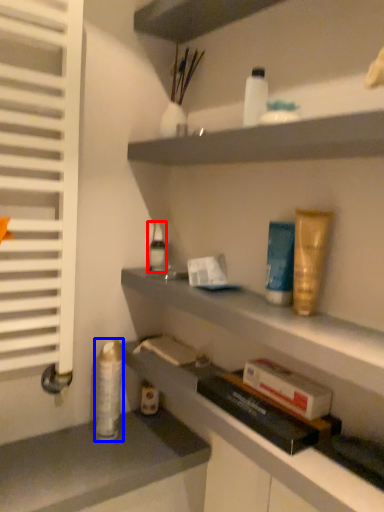
Question: Which of the following is the closest to the observer, toiletry (highlighted by a red box) or toiletry (highlighted by a blue box)?

Choices:
 (A) toiletry
 (B) toiletry

Answer: (B)